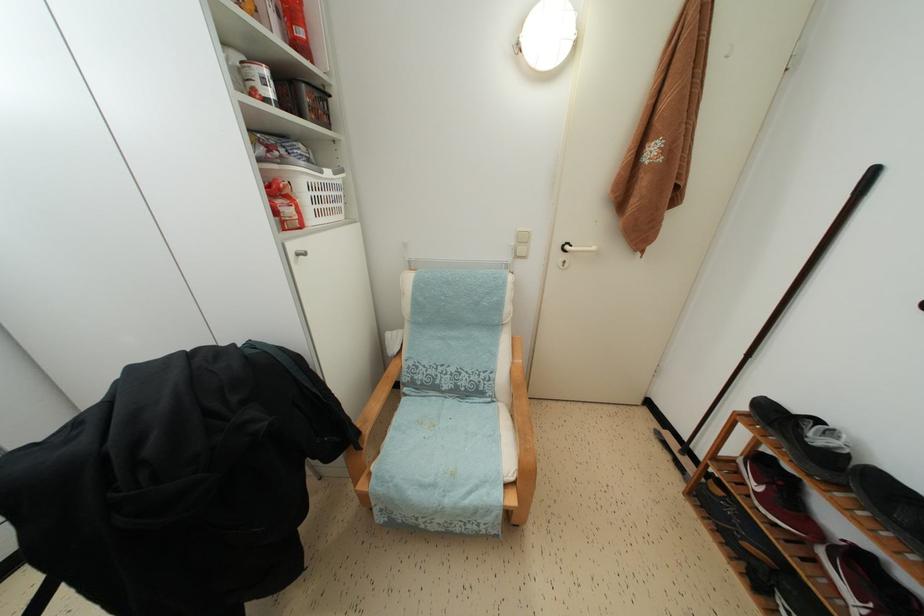
This screenshot has height=616, width=924. What do you see at coordinates (296, 26) in the screenshot?
I see `the red food package` at bounding box center [296, 26].